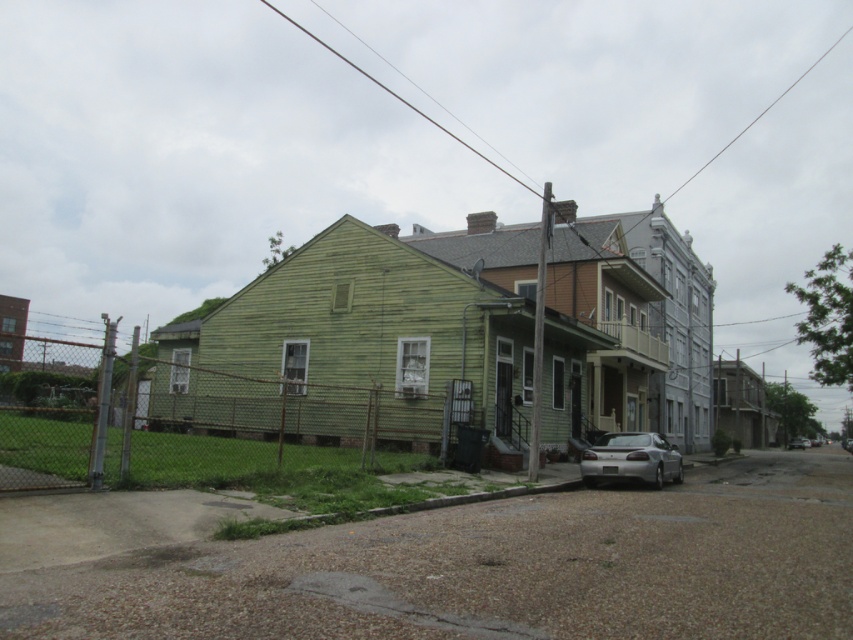
Who is positioned more to the left, silver metallic sedan at lower right or silver metallic sedan at center?

From the viewer's perspective, silver metallic sedan at lower right appears more on the left side.

Is silver metallic sedan at lower right closer to camera compared to silver metallic sedan at center?

Yes, silver metallic sedan at lower right is closer to the viewer.

Does point (613, 456) come closer to viewer compared to point (804, 444)?

Yes, it is in front of point (804, 444).

This screenshot has width=853, height=640. Identify the location of silver metallic sedan at lower right. (631, 458).